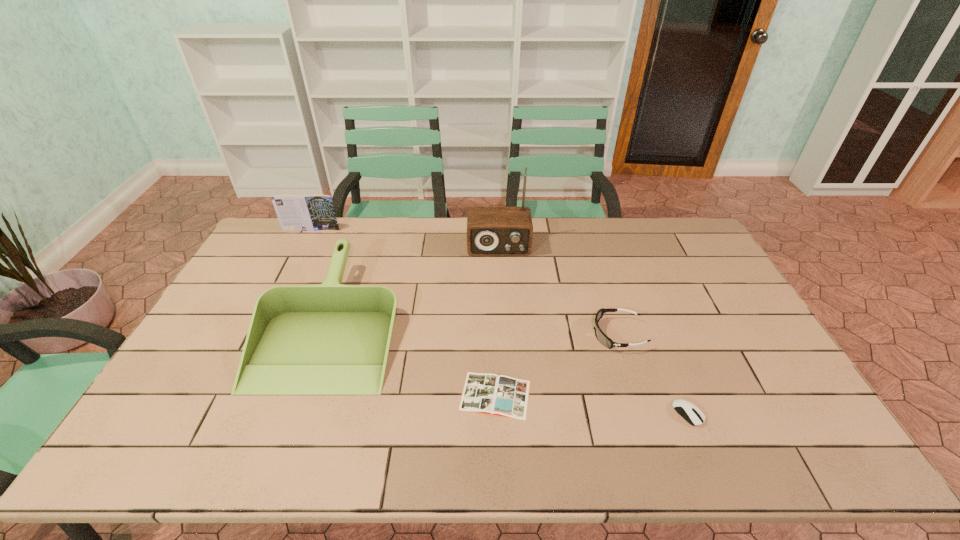
You are a GUI agent. You are given a task and a screenshot of the screen. Output one action in this format:
    pyautogui.click(x=<x>, y=<y>)
    Task: Click on the empty space between the right book and the radio receiver
    
    Given the screenshot: What is the action you would take?
    pyautogui.click(x=497, y=321)

Where is `free spot between the fifth object from left to right and the mouse`? Image resolution: width=960 pixels, height=540 pixels. free spot between the fifth object from left to right and the mouse is located at coordinates (653, 374).

Find the location of a particular element. unoccupied position between the mouse and the shorter book is located at coordinates (591, 404).

Where is `vacant region between the fifth object from left to right and the right book`? This screenshot has width=960, height=540. vacant region between the fifth object from left to right and the right book is located at coordinates (557, 364).

In order to click on empty location between the farther book and the rightmost object in this screenshot , I will do `click(500, 321)`.

Locate an element on the screen. Image resolution: width=960 pixels, height=540 pixels. vacant point located between the shortest object and the goggles is located at coordinates (557, 364).

Where is `vacant area that lies between the shorter book and the third shortest object`? Image resolution: width=960 pixels, height=540 pixels. vacant area that lies between the shorter book and the third shortest object is located at coordinates (557, 364).

The width and height of the screenshot is (960, 540). Identify the location of free spot between the shorter book and the fourth shortest object. (414, 358).

You are a GUI agent. You are given a task and a screenshot of the screen. Output one action in this format:
    pyautogui.click(x=<x>, y=<y>)
    Task: Click on the vacant area between the farther book and the shorter book
    The image size is (960, 540).
    Given the screenshot: What is the action you would take?
    pyautogui.click(x=403, y=313)

Locate an element on the screen. Image resolution: width=960 pixels, height=540 pixels. object that is the third closest one to the right book is located at coordinates (691, 413).